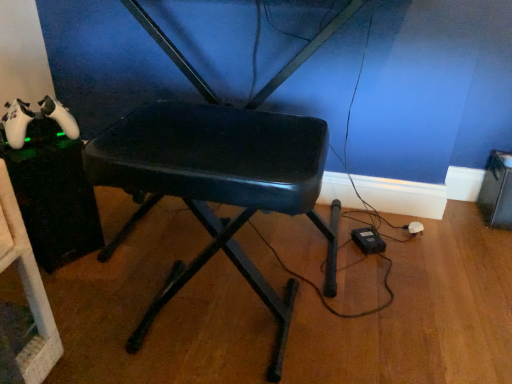
What do you see at coordinates (219, 184) in the screenshot? I see `matte black stool at center` at bounding box center [219, 184].

Identify the location of matte black stool at center. (219, 184).

Measure the distance between matte black stool at center and camera.

They are 26.51 inches apart.

Locate an element on the screen. matte black stool at center is located at coordinates (219, 184).